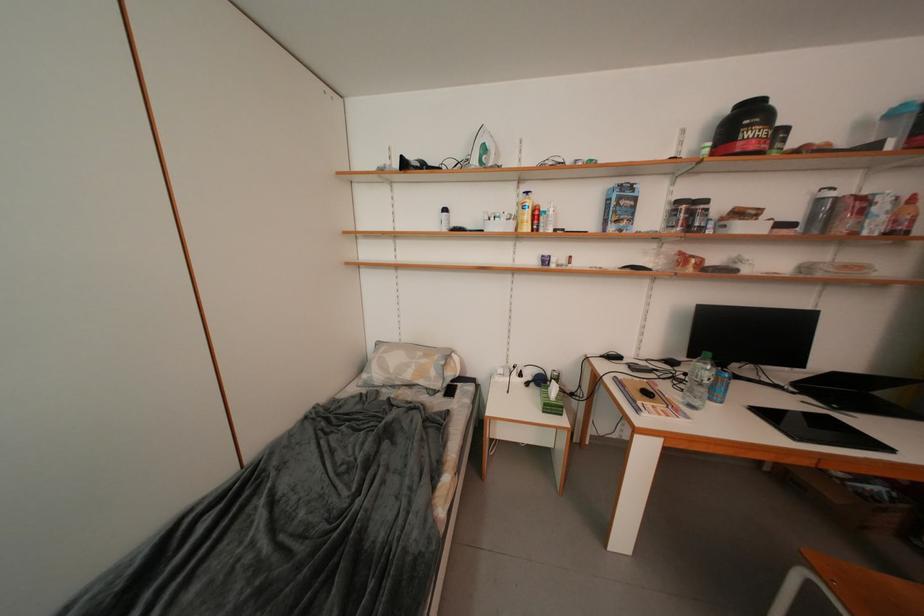
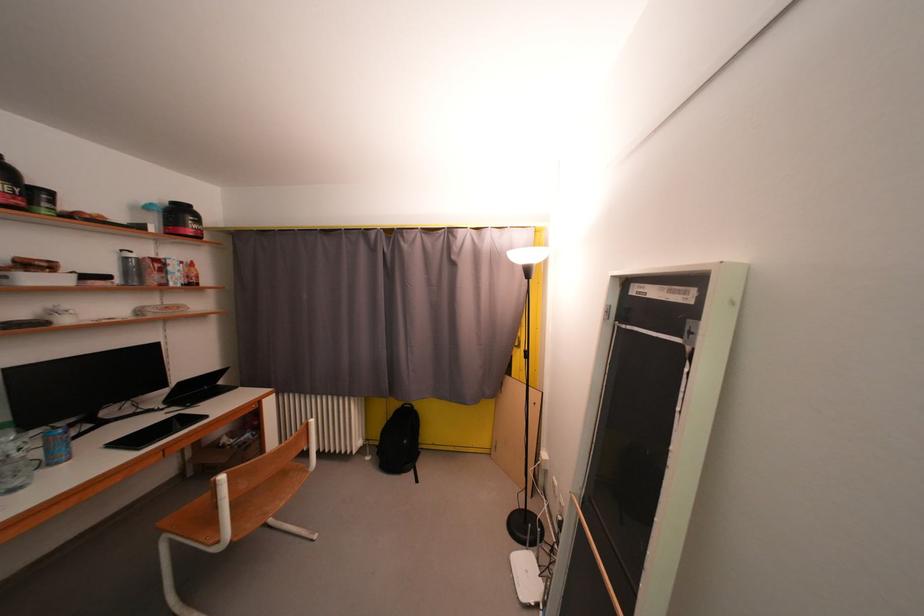
In the second image, find the point that corresponds to pixel 703 407 in the first image.

(25, 487)